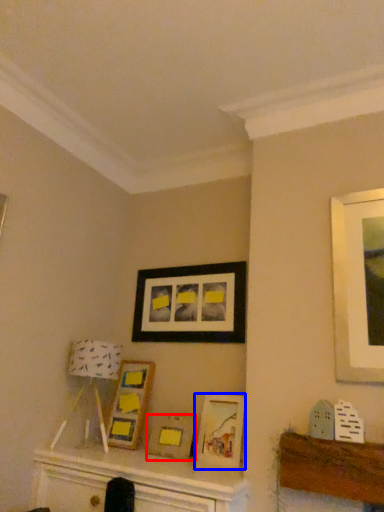
Question: Which object appears closest to the camera in this image, picture frame (highlighted by a red box) or picture frame (highlighted by a blue box)?

Choices:
 (A) picture frame
 (B) picture frame

Answer: (B)